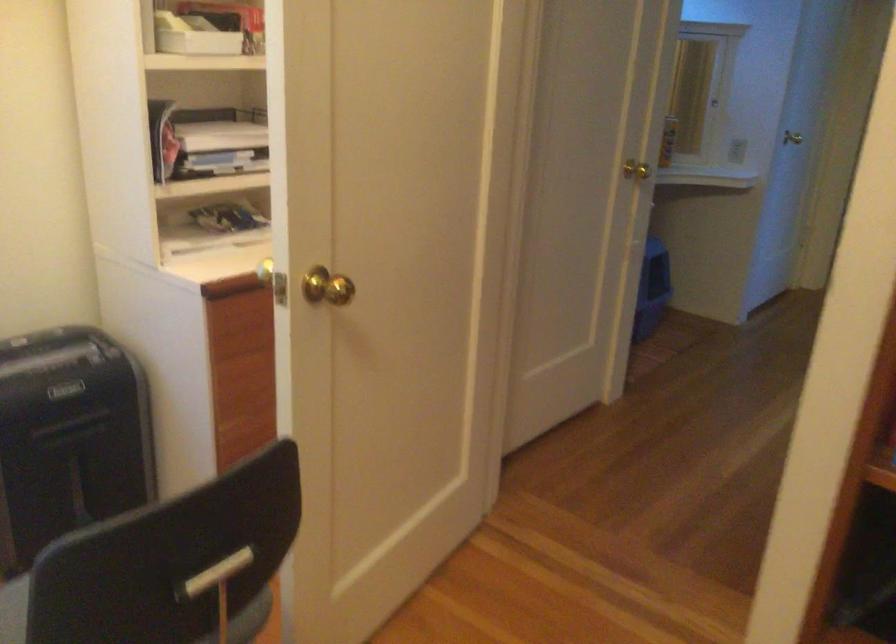
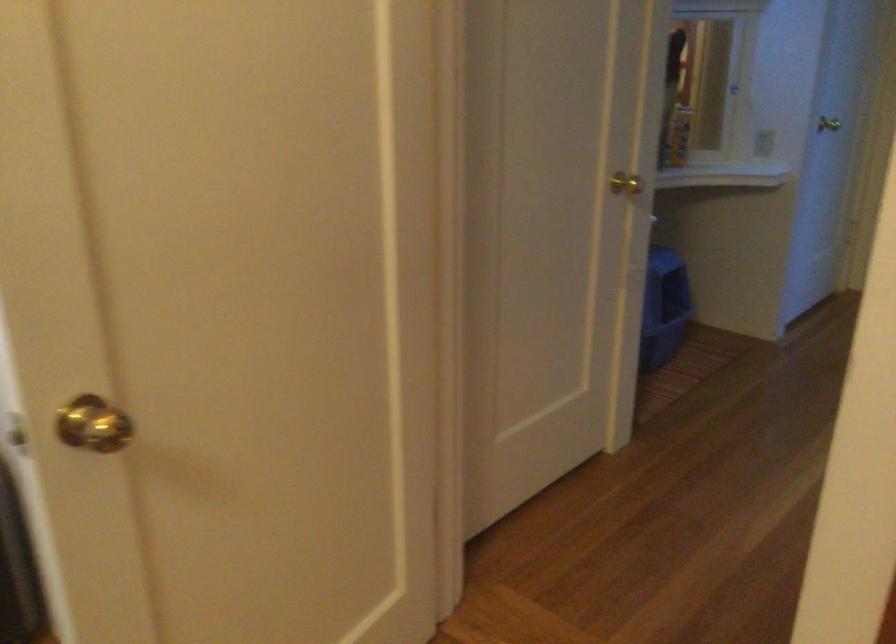
Find the pixel in the second image that matches the point at 739,149 in the first image.

(762, 143)